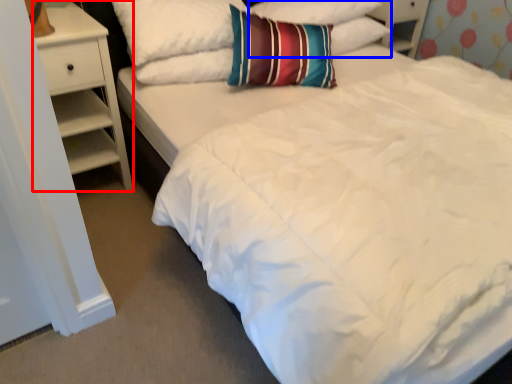
Question: Which object is further to the camera taking this photo, nightstand (highlighted by a red box) or pillow (highlighted by a blue box)?

Choices:
 (A) nightstand
 (B) pillow

Answer: (B)